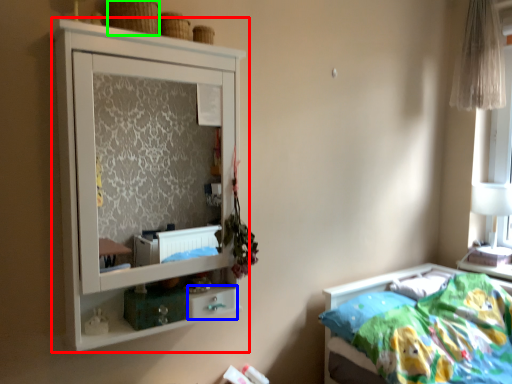
Question: Which object is positioned closest to cupboard (highlighted by a red box)? Select from drawer (highlighted by a blue box) and basket (highlighted by a green box).

Choices:
 (A) drawer
 (B) basket

Answer: (B)